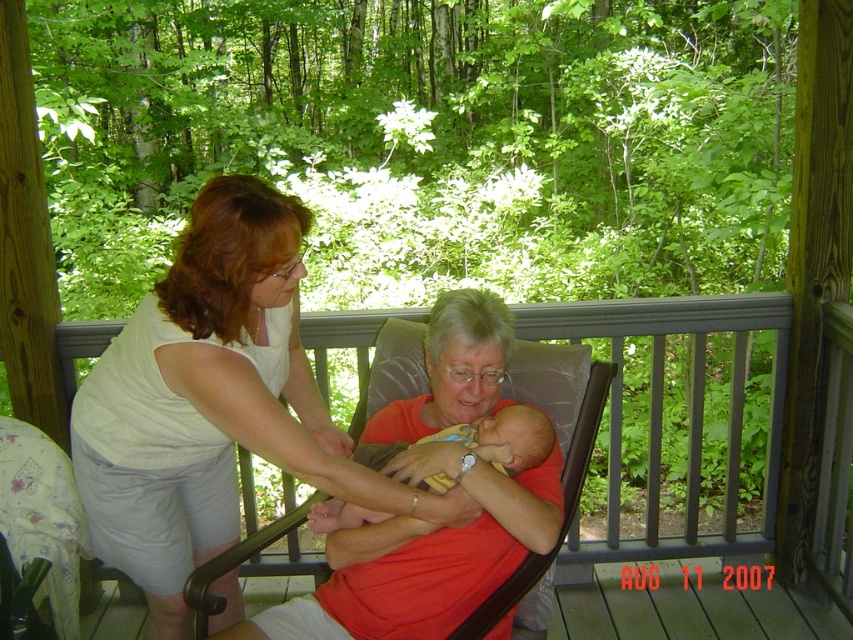
Is brown leather chair at center wider than soft yellow fabric baby at center?

Yes.

Which is in front, point (737, 326) or point (496, 436)?

Point (496, 436) is in front.

Identify the location of brown leather chair at center. Image resolution: width=853 pixels, height=640 pixels. (663, 360).

Image resolution: width=853 pixels, height=640 pixels. In order to click on gray fabric chair at center in this screenshot , I will do `click(560, 467)`.

Which is more to the right, gray fabric chair at center or soft yellow fabric baby at center?

soft yellow fabric baby at center is more to the right.

Who is more forward, (582, 390) or (341, 509)?

Positioned in front is point (341, 509).

I want to click on gray fabric chair at center, so click(x=560, y=467).

Does brown leather chair at center have a greater width compared to gray fabric chair at center?

Correct, the width of brown leather chair at center exceeds that of gray fabric chair at center.

At what (x,y) coordinates should I click in order to perform the action: click on brown leather chair at center. Please return your answer as a coordinate pair (x, y). Looking at the image, I should click on (663, 360).

In order to click on brown leather chair at center in this screenshot , I will do `click(663, 360)`.